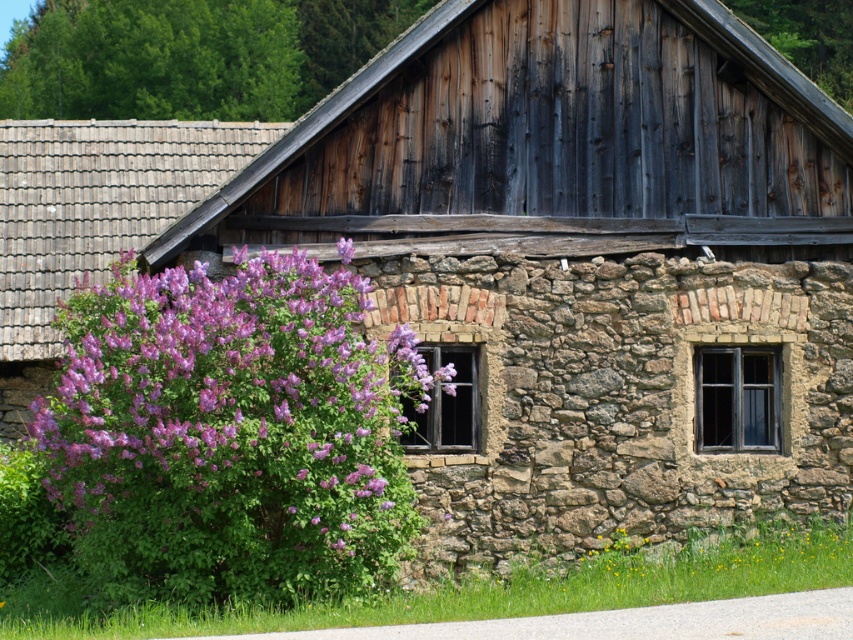
Question: Can you confirm if green leafy tree at upper left is positioned to the left of purple leafy bush at upper center?

Choices:
 (A) no
 (B) yes

Answer: (B)

Question: Is purple leafy bush at left below green leafy tree at upper left?

Choices:
 (A) yes
 (B) no

Answer: (A)

Question: Is green leafy tree at upper left positioned behind purple leafy bush at upper center?

Choices:
 (A) yes
 (B) no

Answer: (A)

Question: Which point appears closest to the camera in this image?

Choices:
 (A) (816, 3)
 (B) (79, 22)
 (C) (390, 529)

Answer: (C)

Question: Which point is farther to the camera?

Choices:
 (A) (10, 44)
 (B) (155, 504)

Answer: (A)

Question: Which point is farther to the camera?

Choices:
 (A) click(846, 83)
 (B) click(380, 448)

Answer: (A)